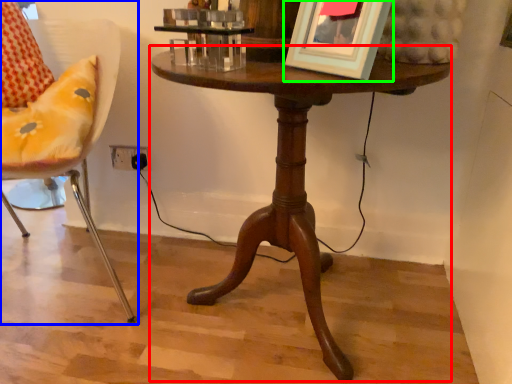
Question: Which object is positioned closest to table (highlighted by a red box)? Select from chair (highlighted by a blue box) and picture frame (highlighted by a green box).

Choices:
 (A) chair
 (B) picture frame

Answer: (B)